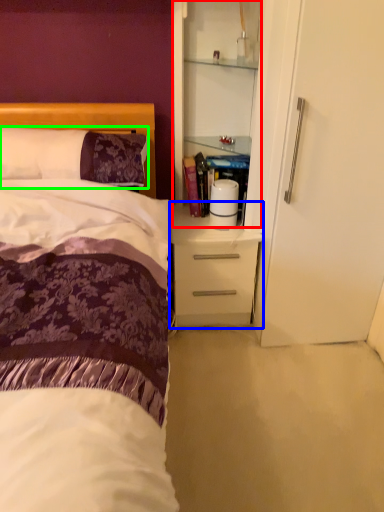
Question: Which object is positioned closest to cabinetry (highlighted by a red box)? Select from desk (highlighted by a blue box) and pillow (highlighted by a green box).

Choices:
 (A) desk
 (B) pillow

Answer: (A)